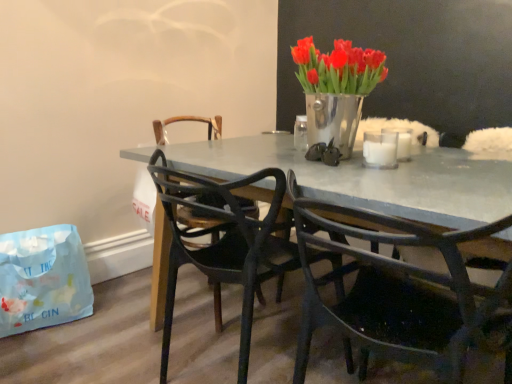
Question: Considering the positions of white matte glass at upper center, the second candle in the back-to-front sequence, and metallic silver vase at upper center in the image, is white matte glass at upper center, the second candle in the back-to-front sequence, wider or thinner than metallic silver vase at upper center?

Choices:
 (A) thin
 (B) wide

Answer: (A)

Question: From the image's perspective, is white matte glass at upper center, the second candle in the back-to-front sequence, positioned above or below metallic silver vase at upper center?

Choices:
 (A) below
 (B) above

Answer: (A)

Question: Which object is the closest to the black plastic chair at center, positioned as the first chair in left-to-right order?

Choices:
 (A) metallic silver vase at upper center
 (B) matte black chair at center, acting as the first chair starting from the right
 (C) light blue paper bag at lower left
 (D) white frosted glass candle at upper right, placed as the 1th candle when sorted from back to front
 (E) white matte glass at upper center, placed as the 1th candle when sorted from front to back

Answer: (B)

Question: Which is nearer to the black plastic chair at center, positioned as the first chair in left-to-right order?

Choices:
 (A) metallic silver vase at upper center
 (B) white matte glass at upper center, the second candle in the back-to-front sequence
 (C) white frosted glass candle at upper right, placed as the 1th candle when sorted from back to front
 (D) matte black chair at center, the 2th chair positioned from the left
 (E) light blue paper bag at lower left

Answer: (D)